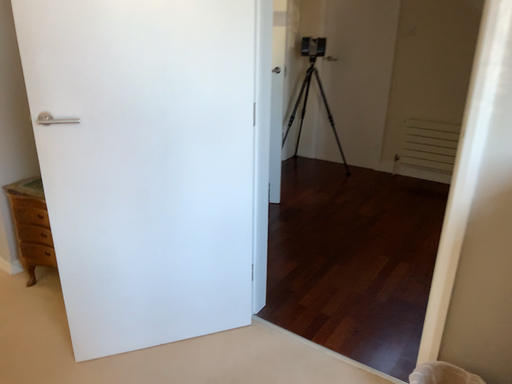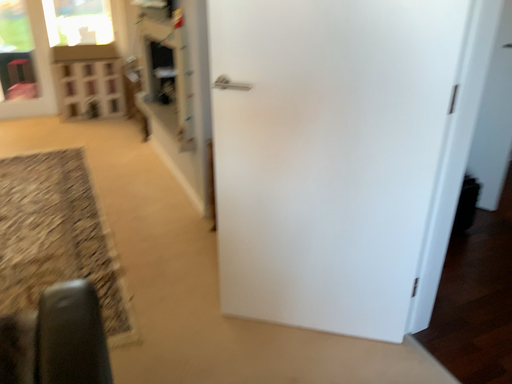
Question: How did the camera likely rotate when shooting the video?

Choices:
 (A) rotated left
 (B) rotated right

Answer: (A)